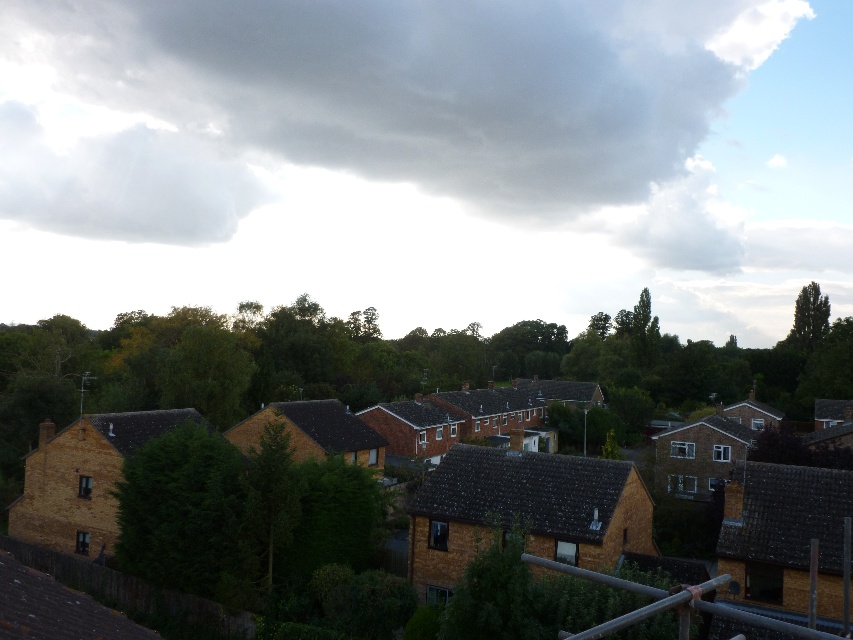
You are a delivery drone that needs to fly from the green leafy tree at left to the metallic gray rail at lower right. Considering their heights, will you have to ascend or descend during your flight?

The green leafy tree at left is shorter than the metallic gray rail at lower right, so you will have to ascend during your flight to reach the metallic gray rail at lower right.

You are standing in the residential area and looking up at the sky. Which cloud, the gray fluffy cloud at upper center or the white fluffy cloud at upper left, would appear larger to you?

The gray fluffy cloud at upper center appears larger because it is closer to the viewer than the white fluffy cloud at upper left.

You are a painter who wants to paint the residential area scene. You notice the white fluffy cloud at upper left and the green leafy tree at left. Which one should you paint first if you want to start with the larger object?

The white fluffy cloud at upper left should be painted first because its width is larger than the green leafy tree at left.